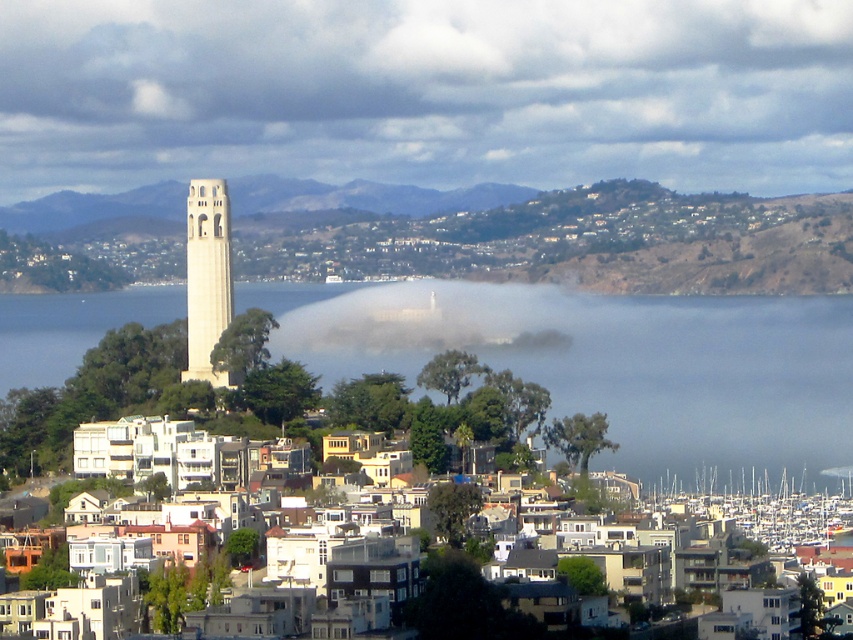
Is transparent fog at center positioned at the back of white translucent fog at center?

No, transparent fog at center is closer to the viewer.

Is point (772, 413) more distant than point (440, 349)?

Yes, it is.

Is point (558, 339) positioned after point (473, 346)?

Yes, it is behind point (473, 346).

Locate an element on the screen. The width and height of the screenshot is (853, 640). transparent fog at center is located at coordinates (606, 360).

Image resolution: width=853 pixels, height=640 pixels. What do you see at coordinates (426, 92) in the screenshot? I see `white mist at center` at bounding box center [426, 92].

Locate an element on the screen. This screenshot has width=853, height=640. white mist at center is located at coordinates (426, 92).

Does white mist at center have a smaller size compared to white stone bell tower at left?

Incorrect, white mist at center is not smaller in size than white stone bell tower at left.

Can you confirm if white mist at center is bigger than white stone bell tower at left?

Indeed, white mist at center has a larger size compared to white stone bell tower at left.

Where is `white mist at center`? The width and height of the screenshot is (853, 640). white mist at center is located at coordinates (426, 92).